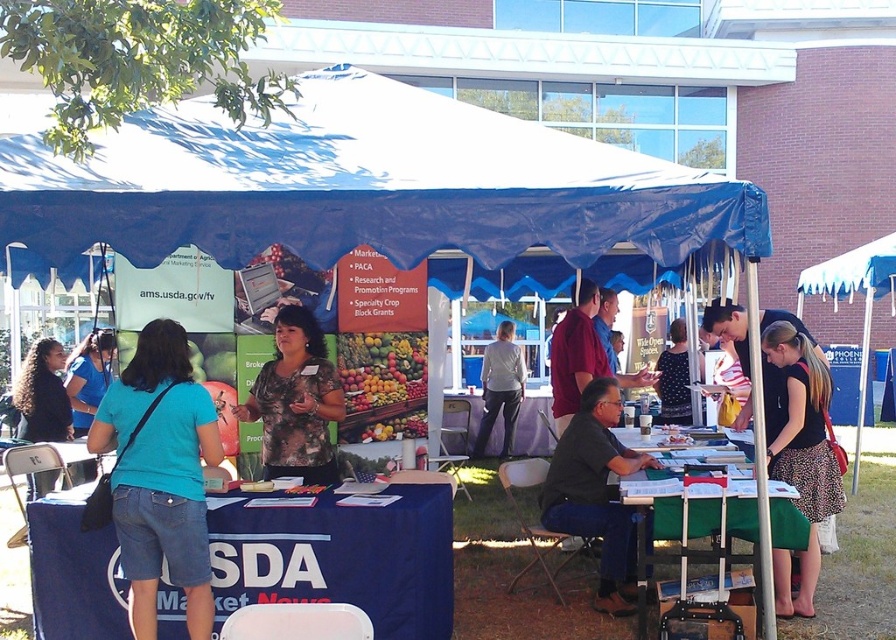
Question: Among these objects, which one is farthest from the camera?

Choices:
 (A) black leopard print skirt at lower right
 (B) floral shirt at center
 (C) dark floral dress at center
 (D) blue fabric table at center

Answer: (D)

Question: Can you confirm if floral shirt at center is bigger than blue fabric table at center?

Choices:
 (A) no
 (B) yes

Answer: (A)

Question: Does black leopard print skirt at lower right have a larger size compared to matte red shirt at center?

Choices:
 (A) yes
 (B) no

Answer: (A)

Question: Among these objects, which one is nearest to the camera?

Choices:
 (A) blue fabric table at center
 (B) blue t-shirt at center

Answer: (B)

Question: Which object appears farthest from the camera in this image?

Choices:
 (A) black leopard print skirt at lower right
 (B) blue denim shorts at lower left
 (C) green fabric table at lower right

Answer: (A)

Question: Is black shirt at center positioned in front of green fabric table at lower right?

Choices:
 (A) no
 (B) yes

Answer: (A)